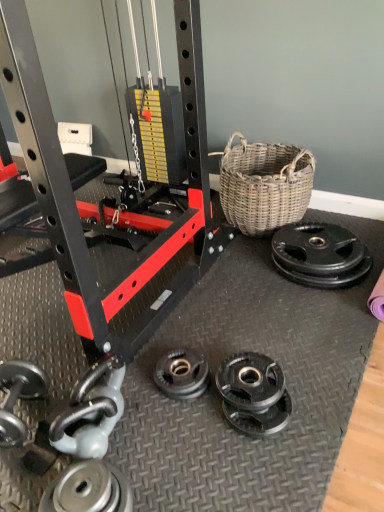
How much space does black rubber weight plate at right, positioned as the first wheel in back-to-front order, occupy horizontally?

The width of black rubber weight plate at right, positioned as the first wheel in back-to-front order, is 14.83 inches.

What do you see at coordinates (317, 249) in the screenshot?
I see `black rubber weight plate at right, which ranks as the first wheel in right-to-left order` at bounding box center [317, 249].

The image size is (384, 512). I want to click on silver metallic weight plate at lower left, positioned as the second wheel in top-to-bottom order, so click(88, 490).

Is woven natural basket at right located within silver metallic dumbbell at lower left?

No, woven natural basket at right is not inside silver metallic dumbbell at lower left.

Can you confirm if silver metallic dumbbell at lower left is thinner than woven natural basket at right?

Yes, silver metallic dumbbell at lower left is thinner than woven natural basket at right.

Which point is more forward, (90, 393) or (239, 201)?

The point (90, 393) is more forward.

Considering the relative sizes of woven natural basket at right and silver metallic weight plate at lower left, which ranks as the second wheel in right-to-left order, in the image provided, is woven natural basket at right shorter than silver metallic weight plate at lower left, which ranks as the second wheel in right-to-left order,?

No, woven natural basket at right is not shorter than silver metallic weight plate at lower left, which ranks as the second wheel in right-to-left order.

Could you tell me if woven natural basket at right is facing silver metallic weight plate at lower left, the 2th wheel viewed from the back?

Yes, woven natural basket at right is oriented towards silver metallic weight plate at lower left, the 2th wheel viewed from the back.

Can you confirm if woven natural basket at right is positioned to the left of silver metallic weight plate at lower left, the 1th wheel when ordered from bottom to top?

Result: In fact, woven natural basket at right is to the right of silver metallic weight plate at lower left, the 1th wheel when ordered from bottom to top.

Considering the sizes of objects woven natural basket at right and silver metallic dumbbell at lower left in the image provided, who is thinner, woven natural basket at right or silver metallic dumbbell at lower left?

silver metallic dumbbell at lower left.

Consider the image. Is woven natural basket at right positioned far away from silver metallic dumbbell at lower left?

woven natural basket at right is positioned a significant distance from silver metallic dumbbell at lower left.

From the image's perspective, would you say woven natural basket at right is positioned over silver metallic dumbbell at lower left?

Indeed, from the image's perspective, woven natural basket at right is shown above silver metallic dumbbell at lower left.

Based on the photo, could you tell me if woven natural basket at right is facing silver metallic dumbbell at lower left?

Yes, woven natural basket at right is aimed at silver metallic dumbbell at lower left.

How different are the orientations of silver metallic weight plate at lower left, the 1th wheel when ordered from bottom to top, and silver metallic dumbbell at lower left in degrees?

The facing directions of silver metallic weight plate at lower left, the 1th wheel when ordered from bottom to top, and silver metallic dumbbell at lower left are 106 degrees apart.

Which is in front, silver metallic weight plate at lower left, which ranks as the second wheel in right-to-left order, or silver metallic dumbbell at lower left?

silver metallic weight plate at lower left, which ranks as the second wheel in right-to-left order, is in front.

Would you say silver metallic weight plate at lower left, the 2th wheel viewed from the back, is inside or outside silver metallic dumbbell at lower left?

The correct answer is: outside.

From the image's perspective, does silver metallic weight plate at lower left, the 2th wheel viewed from the back, appear lower than silver metallic dumbbell at lower left?

Indeed, from the image's perspective, silver metallic weight plate at lower left, the 2th wheel viewed from the back, is shown beneath silver metallic dumbbell at lower left.

From the image's perspective, who appears lower, black rubber weight plate at right, placed as the 1th wheel when sorted from top to bottom, or woven natural basket at right?

black rubber weight plate at right, placed as the 1th wheel when sorted from top to bottom, appears lower in the image.

Considering the points (341, 255) and (223, 158), which point is in front, point (341, 255) or point (223, 158)?

The point (341, 255) is closer to the camera.

Is black rubber weight plate at right, which ranks as the first wheel in right-to-left order, aimed at woven natural basket at right?

No.

In the scene shown: Can you see black rubber weight plate at right, the second wheel positioned from the bottom, touching woven natural basket at right?

No, black rubber weight plate at right, the second wheel positioned from the bottom, is not in contact with woven natural basket at right.

Can we say silver metallic weight plate at lower left, the 2th wheel viewed from the back, lies outside black rubber weight plate at right, the second wheel positioned from the bottom?

Yes, silver metallic weight plate at lower left, the 2th wheel viewed from the back, is located beyond the bounds of black rubber weight plate at right, the second wheel positioned from the bottom.

Considering the relative sizes of silver metallic weight plate at lower left, which ranks as the second wheel in right-to-left order, and black rubber weight plate at right, which ranks as the first wheel in right-to-left order, in the image provided, is silver metallic weight plate at lower left, which ranks as the second wheel in right-to-left order, bigger than black rubber weight plate at right, which ranks as the first wheel in right-to-left order,?

No.

Considering the relative sizes of silver metallic weight plate at lower left, the 2th wheel viewed from the back, and black rubber weight plate at right, the second wheel positioned from the bottom, in the image provided, is silver metallic weight plate at lower left, the 2th wheel viewed from the back, taller than black rubber weight plate at right, the second wheel positioned from the bottom,?

Incorrect, the height of silver metallic weight plate at lower left, the 2th wheel viewed from the back, is not larger of that of black rubber weight plate at right, the second wheel positioned from the bottom.

From a real-world perspective, is silver metallic weight plate at lower left, positioned as the second wheel in top-to-bottom order, under black rubber weight plate at right, positioned as the first wheel in back-to-front order?

Yes, from a real-world perspective, silver metallic weight plate at lower left, positioned as the second wheel in top-to-bottom order, is beneath black rubber weight plate at right, positioned as the first wheel in back-to-front order.

Which point is more forward, (116, 490) or (283, 170)?

The point (116, 490) is in front.

Can you confirm if silver metallic weight plate at lower left, arranged as the first wheel when viewed from the front, is bigger than woven natural basket at right?

No.

This screenshot has width=384, height=512. What are the coordinates of `wheel that is the 2nd object directly below the woven natural basket at right (from a real-world perspective)` in the screenshot? It's located at (88, 490).

Is silver metallic weight plate at lower left, arranged as the first wheel when viewed from the front, oriented away from woven natural basket at right?

No, silver metallic weight plate at lower left, arranged as the first wheel when viewed from the front, is not facing away from woven natural basket at right.

In the image, there is a woven natural basket at right. What are the coordinates of `dumbbell below it (from the image's perspective)` in the screenshot? It's located at (91, 411).

The width and height of the screenshot is (384, 512). Identify the location of picnic basket that appears on the right of silver metallic weight plate at lower left, the first wheel positioned from the left. (264, 185).

Looking at the image, which one is located closer to silver metallic dumbbell at lower left, silver metallic weight plate at lower left, the 1th wheel when ordered from bottom to top, or woven natural basket at right?

silver metallic weight plate at lower left, the 1th wheel when ordered from bottom to top, is closer to silver metallic dumbbell at lower left.

Considering their positions, is silver metallic weight plate at lower left, the first wheel positioned from the left, positioned further to woven natural basket at right than silver metallic dumbbell at lower left?

silver metallic weight plate at lower left, the first wheel positioned from the left, is positioned further to the anchor woven natural basket at right.

Looking at this image, based on their spatial positions, is silver metallic dumbbell at lower left or silver metallic weight plate at lower left, arranged as the first wheel when viewed from the front, closer to woven natural basket at right?

silver metallic dumbbell at lower left.

Based on their spatial positions, is woven natural basket at right or silver metallic weight plate at lower left, the first wheel positioned from the left, closer to silver metallic dumbbell at lower left?

silver metallic weight plate at lower left, the first wheel positioned from the left.

Based on the photo, considering their positions, is woven natural basket at right positioned closer to silver metallic weight plate at lower left, the 2th wheel viewed from the back, than silver metallic dumbbell at lower left?

silver metallic dumbbell at lower left is closer to silver metallic weight plate at lower left, the 2th wheel viewed from the back.

Based on their spatial positions, is woven natural basket at right or black rubber weight plate at right, the second wheel in the left-to-right sequence, further from silver metallic dumbbell at lower left?

woven natural basket at right lies further to silver metallic dumbbell at lower left than the other object.

Based on the photo, which object lies further to the anchor point silver metallic weight plate at lower left, which ranks as the second wheel in right-to-left order, black rubber weight plate at right, positioned as the first wheel in back-to-front order, or woven natural basket at right?

Among the two, woven natural basket at right is located further to silver metallic weight plate at lower left, which ranks as the second wheel in right-to-left order.

Estimate the real-world distances between objects in this image. Which object is further from woven natural basket at right, silver metallic dumbbell at lower left or black rubber weight plate at right, acting as the 2th wheel starting from the front?

silver metallic dumbbell at lower left.

This screenshot has width=384, height=512. I want to click on wheel between woven natural basket at right and silver metallic weight plate at lower left, the 1th wheel when ordered from bottom to top, in the vertical direction, so click(x=317, y=249).

Locate an element on the screen. This screenshot has height=512, width=384. dumbbell between woven natural basket at right and silver metallic weight plate at lower left, the 1th wheel when ordered from bottom to top, in the vertical direction is located at coordinates (91, 411).

Find the location of `picnic basket situated between silver metallic dumbbell at lower left and black rubber weight plate at right, acting as the 2th wheel starting from the front, from left to right`. picnic basket situated between silver metallic dumbbell at lower left and black rubber weight plate at right, acting as the 2th wheel starting from the front, from left to right is located at coordinates (264, 185).

In order to click on wheel situated between silver metallic dumbbell at lower left and black rubber weight plate at right, placed as the 1th wheel when sorted from top to bottom, from left to right in this screenshot , I will do `click(88, 490)`.